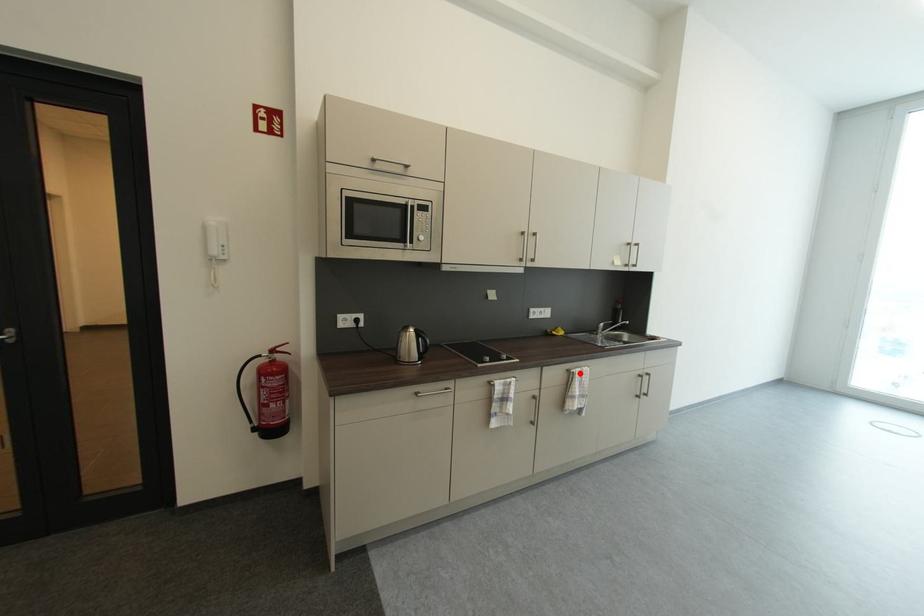
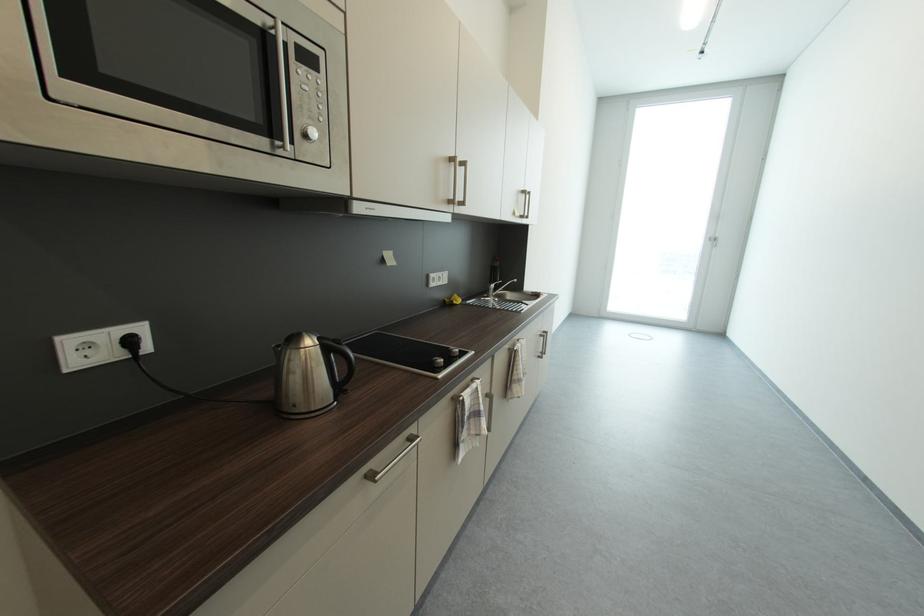
The point at the highlighted location is marked in the first image. Where is the corresponding point in the second image?

(523, 351)